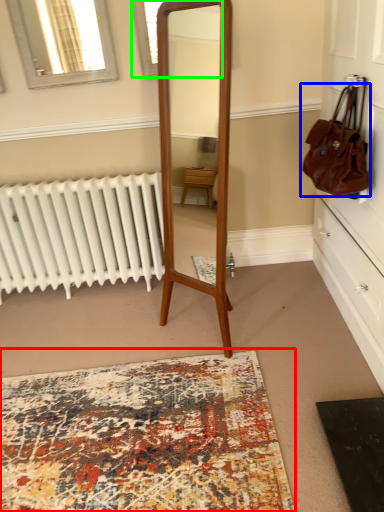
Question: Which object is positioned closest to mat (highlighted by a red box)? Select from handbag (highlighted by a blue box) and window (highlighted by a green box).

Choices:
 (A) handbag
 (B) window

Answer: (A)